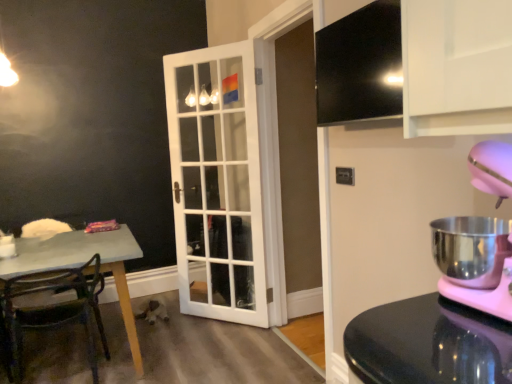
Question: Does black glossy exhaust hood at upper right touch metallic green chair at left?

Choices:
 (A) yes
 (B) no

Answer: (B)

Question: Considering the relative sizes of black glossy exhaust hood at upper right and metallic green chair at left in the image provided, is black glossy exhaust hood at upper right smaller than metallic green chair at left?

Choices:
 (A) no
 (B) yes

Answer: (B)

Question: Is black glossy exhaust hood at upper right at the right side of metallic green chair at left?

Choices:
 (A) yes
 (B) no

Answer: (A)

Question: Can you confirm if black glossy exhaust hood at upper right is thinner than metallic green chair at left?

Choices:
 (A) no
 (B) yes

Answer: (B)

Question: Is black glossy exhaust hood at upper right bigger than metallic green chair at left?

Choices:
 (A) no
 (B) yes

Answer: (A)

Question: From the image's perspective, is metallic green chair at left above or below white glass door at center?

Choices:
 (A) below
 (B) above

Answer: (A)

Question: From a real-world perspective, is metallic green chair at left physically located above or below white glass door at center?

Choices:
 (A) below
 (B) above

Answer: (A)

Question: Is point (96, 317) positioned closer to the camera than point (209, 62)?

Choices:
 (A) farther
 (B) closer

Answer: (A)

Question: In terms of height, does metallic green chair at left look taller or shorter compared to white glass door at center?

Choices:
 (A) tall
 (B) short

Answer: (B)

Question: Is point (91, 301) positioned closer to the camera than point (480, 144)?

Choices:
 (A) closer
 (B) farther

Answer: (B)

Question: In terms of height, does metallic green chair at left look taller or shorter compared to pink plastic mixer at right?

Choices:
 (A) short
 (B) tall

Answer: (B)

Question: From the image's perspective, is metallic green chair at left positioned above or below pink plastic mixer at right?

Choices:
 (A) below
 (B) above

Answer: (A)

Question: Is metallic green chair at left bigger or smaller than pink plastic mixer at right?

Choices:
 (A) small
 (B) big

Answer: (B)

Question: Considering the positions of point (2, 251) and point (194, 311), is point (2, 251) closer or farther from the camera than point (194, 311)?

Choices:
 (A) closer
 (B) farther

Answer: (A)

Question: From a real-world perspective, is white glossy coffee cup at lower left positioned above or below white glass door at center?

Choices:
 (A) above
 (B) below

Answer: (B)